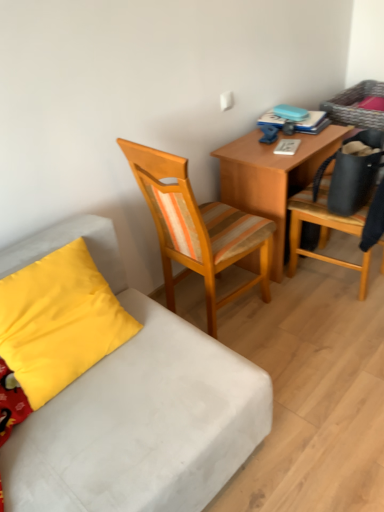
The image size is (384, 512). What do you see at coordinates (272, 177) in the screenshot?
I see `wooden desk at center` at bounding box center [272, 177].

Find the location of `wooden desk at center`. wooden desk at center is located at coordinates (272, 177).

Describe the element at coordinates (135, 407) in the screenshot. I see `white fabric studio couch at lower left` at that location.

What are the coordinates of `yellow fabric pillow at lower left` in the screenshot? It's located at (59, 321).

Describe the element at coordinates (59, 321) in the screenshot. I see `yellow fabric pillow at lower left` at that location.

Find the location of a particular element. The image size is (384, 512). wooden desk at center is located at coordinates (272, 177).

Is woodenchair at center, positioned as the second chair in right-to-left order, touching wooden desk at center?

woodenchair at center, positioned as the second chair in right-to-left order, is not next to wooden desk at center, and they're not touching.

You are a GUI agent. You are given a task and a screenshot of the screen. Output one action in this format:
    pyautogui.click(x=<x>, y=<y>)
    Task: Click on the chair on the left side of wooden desk at center
    
    Given the screenshot: What is the action you would take?
    pyautogui.click(x=197, y=228)

Is woodenchair at center, the first chair positioned from the left, looking in the opposite direction of wooden desk at center?

woodenchair at center, the first chair positioned from the left, is not turned away from wooden desk at center.

Is woodenchair at center, positioned as the second chair in right-to-left order, positioned beyond the bounds of white fabric studio couch at lower left?

woodenchair at center, positioned as the second chair in right-to-left order, is positioned outside white fabric studio couch at lower left.

From the image's perspective, between woodenchair at center, positioned as the second chair in right-to-left order, and white fabric studio couch at lower left, which one is located above?

woodenchair at center, positioned as the second chair in right-to-left order, is shown above in the image.

Is woodenchair at center, the first chair positioned from the left, at the left side of white fabric studio couch at lower left?

Yes.

Based on the photo, from a real-world perspective, which is physically below, woodenchair at center, the first chair positioned from the left, or white fabric studio couch at lower left?

white fabric studio couch at lower left, from a real-world perspective.

Between yellow fabric pillow at lower left and white fabric studio couch at lower left, which one appears on the left side from the viewer's perspective?

Positioned to the left is yellow fabric pillow at lower left.

Is yellow fabric pillow at lower left positioned in front of white fabric studio couch at lower left?

Yes.

How different are the orientations of yellow fabric pillow at lower left and white fabric studio couch at lower left in degrees?

They differ by 3.12 degrees in their facing directions.

Based on the photo, is yellow fabric pillow at lower left facing away from white fabric studio couch at lower left?

No, white fabric studio couch at lower left is not at the back of yellow fabric pillow at lower left.

Between white fabric studio couch at lower left and wooden chair at right, the second chair viewed from the left, which one has larger size?

Bigger between the two is wooden chair at right, the second chair viewed from the left.

Consider the image. From the image's perspective, does white fabric studio couch at lower left appear lower than wooden chair at right, the second chair viewed from the left?

Yes, from the image's perspective, white fabric studio couch at lower left is beneath wooden chair at right, the second chair viewed from the left.

Is white fabric studio couch at lower left far from wooden chair at right, the second chair viewed from the left?

Yes, white fabric studio couch at lower left and wooden chair at right, the second chair viewed from the left, are quite far apart.

Is point (164, 370) farther from camera compared to point (310, 192)?

No, it is in front of (310, 192).

Does wooden desk at center come in front of wooden chair at right, the first chair positioned from the right?

No, wooden desk at center is further to the viewer.

Considering the points (282, 261) and (325, 168), which point is behind, point (282, 261) or point (325, 168)?

The point (282, 261) is behind.

Who is bigger, wooden desk at center or wooden chair at right, the second chair viewed from the left?

wooden chair at right, the second chair viewed from the left, is bigger.

Is wooden desk at center next to wooden chair at right, the second chair viewed from the left?

They are not placed beside each other.

Considering the relative sizes of woodenchair at center, positioned as the second chair in right-to-left order, and wooden chair at right, the first chair positioned from the right, in the image provided, is woodenchair at center, positioned as the second chair in right-to-left order, shorter than wooden chair at right, the first chair positioned from the right,?

No, woodenchair at center, positioned as the second chair in right-to-left order, is not shorter than wooden chair at right, the first chair positioned from the right.

At what (x,y) coordinates should I click in order to perform the action: click on chair below the wooden chair at right, the second chair viewed from the left (from the image's perspective). Please return your answer as a coordinate pair (x, y). Looking at the image, I should click on (197, 228).

Measure the distance from woodenchair at center, the first chair positioned from the left, to wooden chair at right, the second chair viewed from the left.

They are 19.27 inches apart.

Looking at the image, does wooden chair at right, the second chair viewed from the left, seem bigger or smaller compared to yellow fabric pillow at lower left?

wooden chair at right, the second chair viewed from the left, is bigger than yellow fabric pillow at lower left.

From the image's perspective, is wooden chair at right, the first chair positioned from the right, on yellow fabric pillow at lower left?

Indeed, from the image's perspective, wooden chair at right, the first chair positioned from the right, is shown above yellow fabric pillow at lower left.

How many degrees apart are the facing directions of wooden chair at right, the second chair viewed from the left, and yellow fabric pillow at lower left?

They differ by 175 degrees in their facing directions.

Does wooden chair at right, the first chair positioned from the right, appear on the left side of yellow fabric pillow at lower left?

No.

Where is `desk on the right of woodenchair at center, positioned as the second chair in right-to-left order`? The height and width of the screenshot is (512, 384). desk on the right of woodenchair at center, positioned as the second chair in right-to-left order is located at coordinates (272, 177).

At what (x,y) coordinates should I click in order to perform the action: click on studio couch in front of the woodenchair at center, positioned as the second chair in right-to-left order. Please return your answer as a coordinate pair (x, y). The height and width of the screenshot is (512, 384). Looking at the image, I should click on (135, 407).

Based on their spatial positions, is white fabric studio couch at lower left or wooden chair at right, the first chair positioned from the right, further from wooden desk at center?

white fabric studio couch at lower left.

Considering their positions, is wooden desk at center positioned closer to yellow fabric pillow at lower left than white fabric studio couch at lower left?

Based on the image, white fabric studio couch at lower left appears to be nearer to yellow fabric pillow at lower left.

When comparing their distances from woodenchair at center, positioned as the second chair in right-to-left order, does wooden chair at right, the first chair positioned from the right, or wooden desk at center seem closer?

Based on the image, wooden desk at center appears to be nearer to woodenchair at center, positioned as the second chair in right-to-left order.

Based on their spatial positions, is wooden chair at right, the first chair positioned from the right, or woodenchair at center, the first chair positioned from the left, closer to wooden desk at center?

wooden chair at right, the first chair positioned from the right, is closer to wooden desk at center.

Considering their positions, is yellow fabric pillow at lower left positioned further to white fabric studio couch at lower left than wooden chair at right, the second chair viewed from the left?

wooden chair at right, the second chair viewed from the left.

Looking at the image, which one is located closer to white fabric studio couch at lower left, yellow fabric pillow at lower left or wooden desk at center?

Among the two, yellow fabric pillow at lower left is located nearer to white fabric studio couch at lower left.

When comparing their distances from wooden chair at right, the second chair viewed from the left, does woodenchair at center, positioned as the second chair in right-to-left order, or yellow fabric pillow at lower left seem closer?

woodenchair at center, positioned as the second chair in right-to-left order.

Looking at the image, which one is located further to wooden chair at right, the second chair viewed from the left, woodenchair at center, the first chair positioned from the left, or white fabric studio couch at lower left?

Based on the image, white fabric studio couch at lower left appears to be further to wooden chair at right, the second chair viewed from the left.

Identify the location of desk between woodenchair at center, the first chair positioned from the left, and wooden chair at right, the first chair positioned from the right. The width and height of the screenshot is (384, 512). (272, 177).

What are the coordinates of `studio couch between yellow fabric pillow at lower left and wooden desk at center in the horizontal direction` in the screenshot? It's located at (135, 407).

You are a GUI agent. You are given a task and a screenshot of the screen. Output one action in this format:
    pyautogui.click(x=<x>, y=<y>)
    Task: Click on the studio couch located between woodenchair at center, the first chair positioned from the left, and wooden chair at right, the second chair viewed from the left, in the left-right direction
    
    Given the screenshot: What is the action you would take?
    pyautogui.click(x=135, y=407)

This screenshot has width=384, height=512. I want to click on chair situated between yellow fabric pillow at lower left and wooden chair at right, the first chair positioned from the right, from left to right, so click(x=197, y=228).